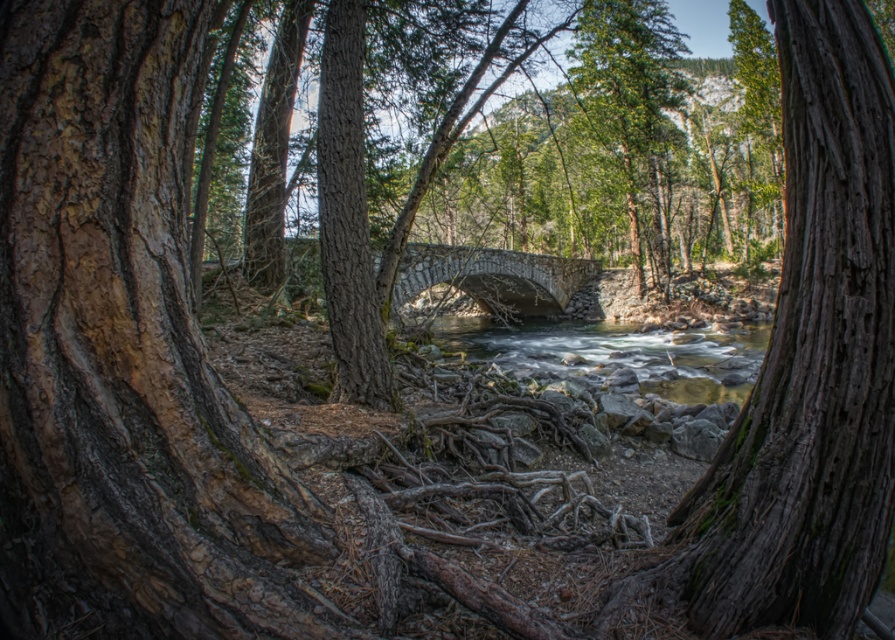
You are standing at the point marked as point (618,353) in the image. What can you see around you?

You can see clear water at center around you.

From the picture: You are standing on the stone bridge at center and want to cross to the other side. Can you see the clear water at center flowing underneath you?

The stone bridge at center is behind clear water at center, so the clear water at center is in front of the bridge. Therefore, you cannot see the clear water at center flowing underneath the stone bridge at center because it is positioned in front of the bridge.

You are standing at the edge of a river and see the smooth brown tree trunk at center and the clear water at center. Which object is located to the left side from your perspective?

The smooth brown tree trunk at center is located to the left of the clear water at center.